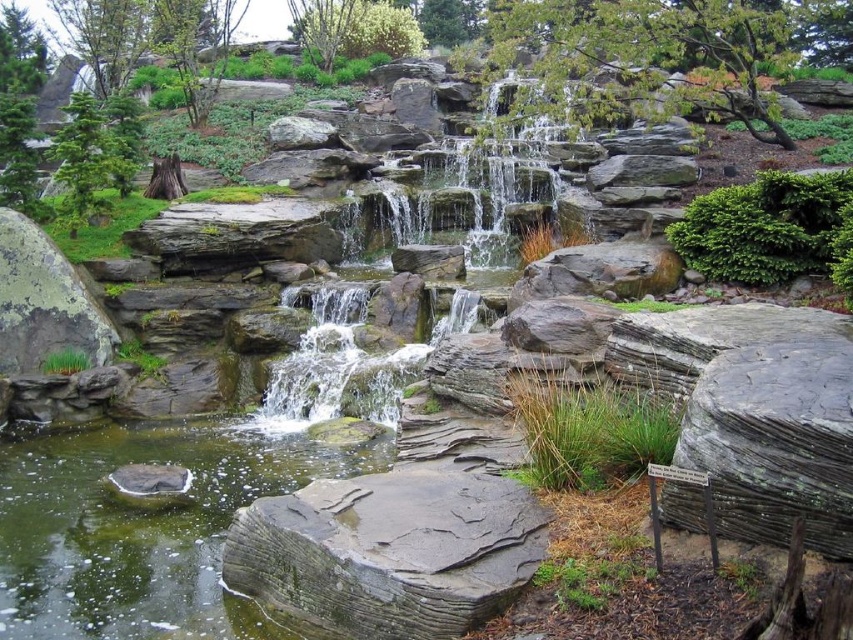
Question: Which point appears farthest from the camera in this image?

Choices:
 (A) (202, 568)
 (B) (369, 266)
 (C) (33, 236)

Answer: (B)

Question: Can you confirm if greenish stone water at lower left is positioned to the right of green mossy rock at center?

Choices:
 (A) yes
 (B) no

Answer: (B)

Question: Among these points, which one is farthest from the camera?

Choices:
 (A) (102, 548)
 (B) (378, 413)

Answer: (B)

Question: Is the position of greenish stone water at lower left more distant than that of gray slate boulder at lower center?

Choices:
 (A) yes
 (B) no

Answer: (A)

Question: Among these objects, which one is farthest from the camera?

Choices:
 (A) green mossy rock at left
 (B) greenish stone water at lower left

Answer: (A)

Question: Does gray slate boulder at lower center have a lesser width compared to green mossy rock at center?

Choices:
 (A) no
 (B) yes

Answer: (B)